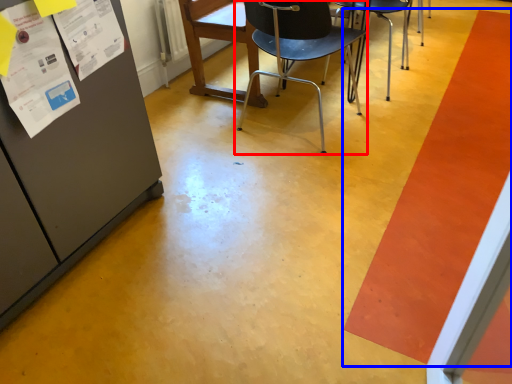
Question: Among these objects, which one is nearest to the camera, chair (highlighted by a red box) or strip (highlighted by a blue box)?

Choices:
 (A) chair
 (B) strip

Answer: (B)